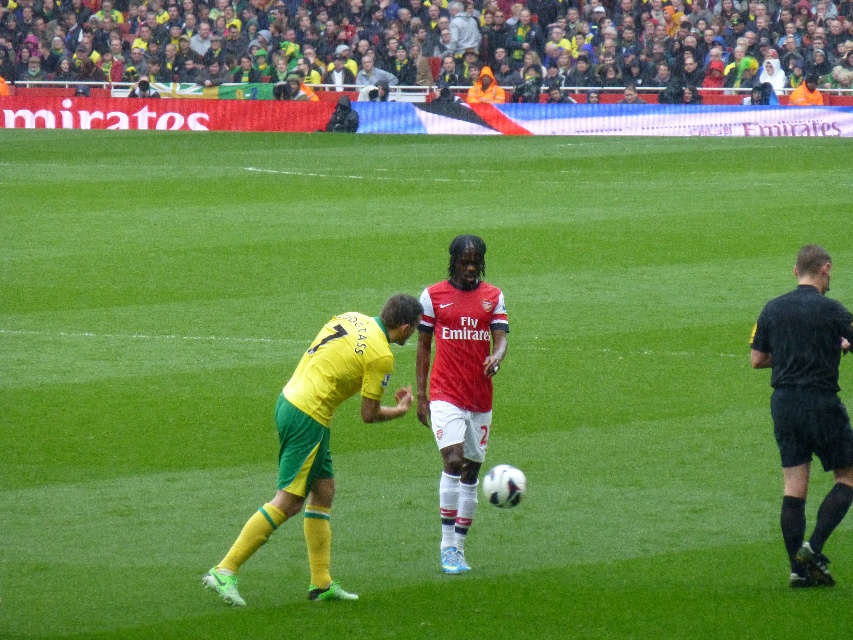
Question: Which object is farther from the camera taking this photo?

Choices:
 (A) yellow-green jersey at center-left
 (B) matte red jersey at center

Answer: (B)

Question: Is black fabric shirt at right thinner than matte red jersey at center?

Choices:
 (A) no
 (B) yes

Answer: (B)

Question: Does black fabric shirt at right appear on the left side of matte red jersey at center?

Choices:
 (A) yes
 (B) no

Answer: (B)

Question: Estimate the real-world distances between objects in this image. Which object is closer to the yellow-green jersey at center-left?

Choices:
 (A) yellow-green jersey at center
 (B) matte red jersey at center
 (C) black fabric shirt at right

Answer: (B)

Question: Can you confirm if yellow-green jersey at center is positioned to the right of yellow-green jersey at center-left?

Choices:
 (A) no
 (B) yes

Answer: (A)

Question: Which of the following is the closest to the observer?

Choices:
 (A) (770, 381)
 (B) (705, 67)
 (C) (408, 323)

Answer: (C)